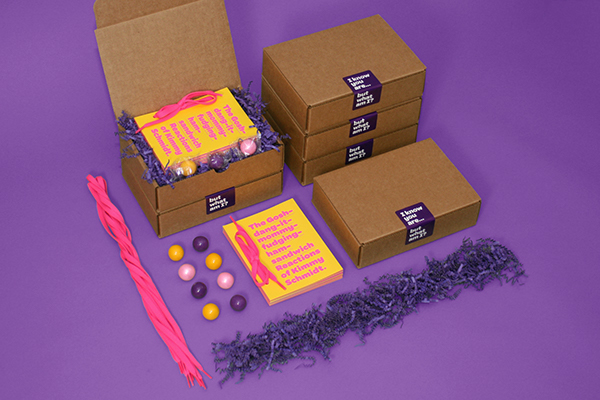
The image size is (600, 400). In order to click on decoration in this screenshot , I will do click(225, 274).